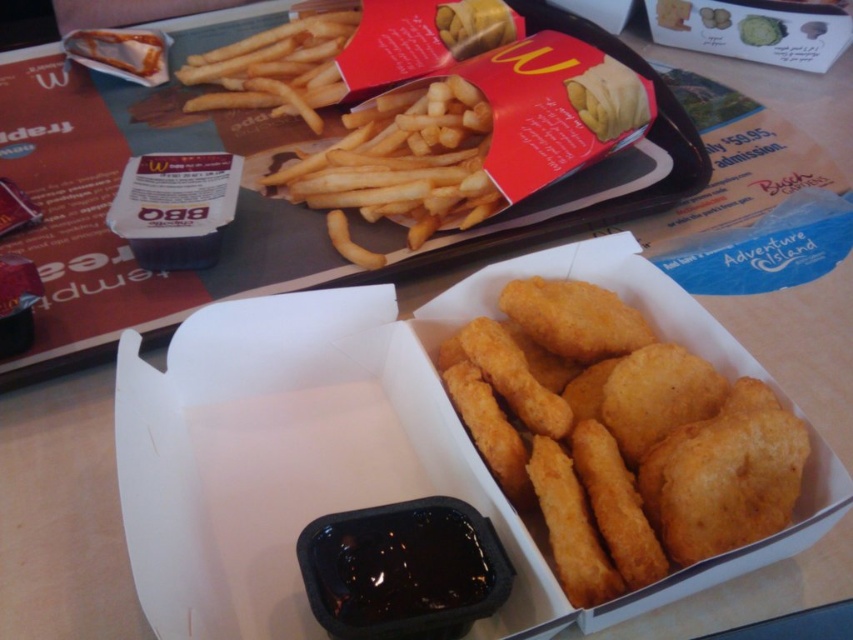
You are trying to reach the point at coordinates (x=485, y=368) on the table. Your hand is currently 25 inches away from the table surface. Can you touch the point without moving your hand closer?

The point at coordinates (x=485, y=368) is 25.25 inches from the viewer. Since your hand is only 25 inches away, it is slightly farther than your hand, so you cannot touch it without moving closer.

You are at a McDonalds table and see the golden fried nuggets at center and the golden crispy french fries at upper center. Which one is more to the right?

The golden fried nuggets at center is positioned on the right side of golden crispy french fries at upper center, so the nuggets are more to the right.

You are a food delivery person who needs to stack these items in a delivery box. Given that the golden fried nuggets at center and the golden crispy fries at upper center are both on the table, which item should you place first to ensure the taller one is on top?

The golden crispy fries at upper center are taller than the golden fried nuggets at center, so you should place the golden crispy fries at upper center on top to ensure the taller item is stacked properly.